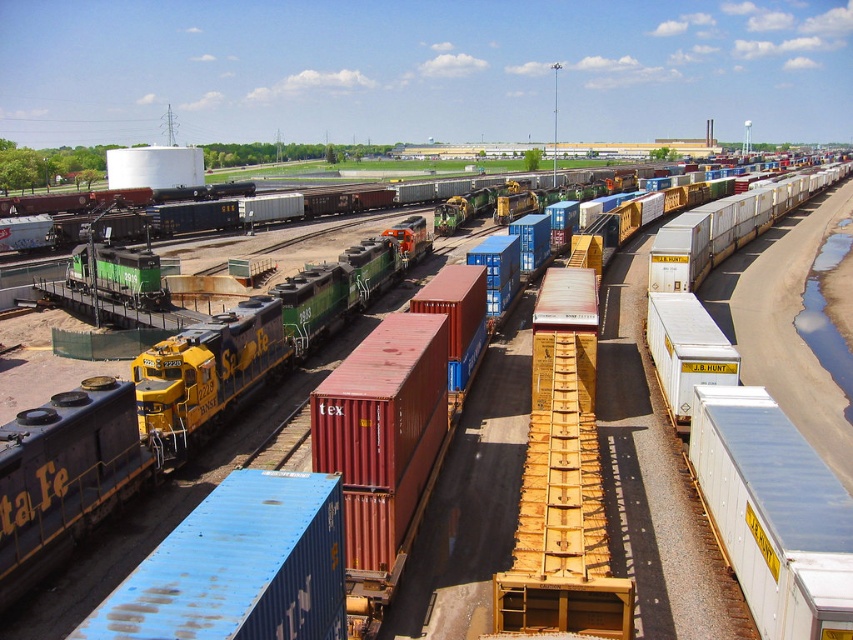
Does yellow matte train car at lower left have a lesser height compared to blue matte container at center?

No.

Locate an element on the screen. The image size is (853, 640). yellow matte train car at lower left is located at coordinates (114, 436).

Is point (131, 486) positioned in front of point (74, 637)?

No, (131, 486) is behind (74, 637).

The image size is (853, 640). What are the coordinates of `yellow matte train car at lower left` in the screenshot? It's located at (114, 436).